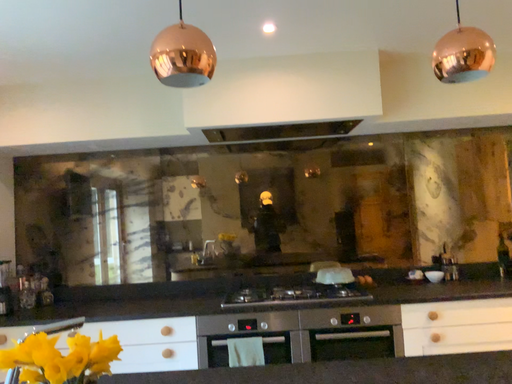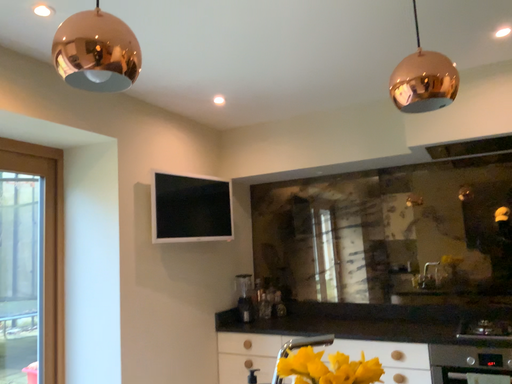
Question: Which way did the camera rotate in the video?

Choices:
 (A) rotated right
 (B) rotated left

Answer: (B)